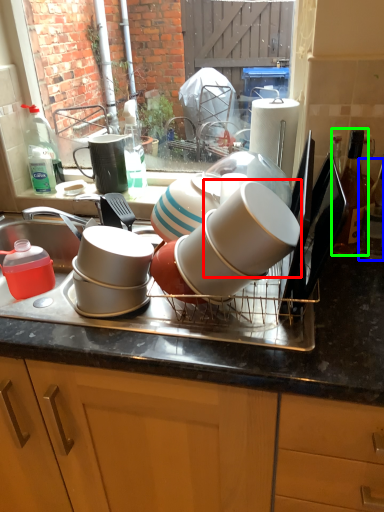
Question: Which is nearer to the tableware (highlighted by a red box)? bottle (highlighted by a blue box) or bottle (highlighted by a green box).

Choices:
 (A) bottle
 (B) bottle

Answer: (B)